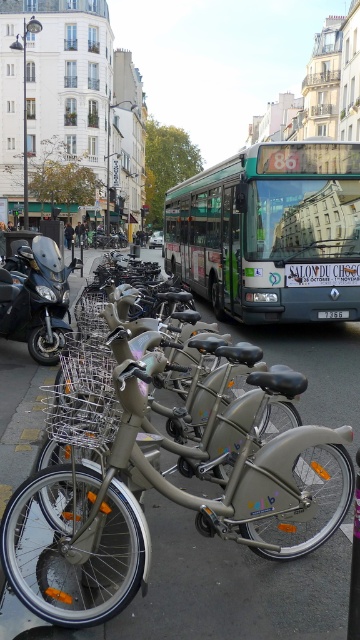
Question: Which object appears farthest from the camera in this image?

Choices:
 (A) gray asphalt at center
 (B) green metallic bus at center

Answer: (B)

Question: Which of the following is the closest to the observer?

Choices:
 (A) gray asphalt at center
 (B) matte black motorcycle at left
 (C) green metallic bus at center

Answer: (A)

Question: Estimate the real-world distances between objects in this image. Which object is farther from the gray asphalt at center?

Choices:
 (A) matte black motorcycle at left
 (B) green metallic bus at center

Answer: (B)

Question: Can you confirm if gray asphalt at center is smaller than matte black motorcycle at left?

Choices:
 (A) yes
 (B) no

Answer: (B)

Question: Can you confirm if gray asphalt at center is positioned to the right of matte black motorcycle at left?

Choices:
 (A) no
 (B) yes

Answer: (B)

Question: Is gray asphalt at center bigger than matte black motorcycle at left?

Choices:
 (A) yes
 (B) no

Answer: (A)